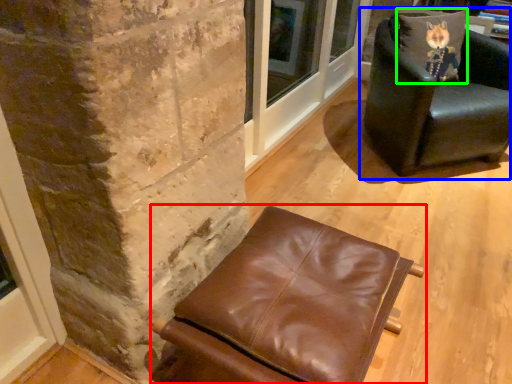
Question: Considering the real-world distances, which object is farthest from chair (highlighted by a red box)? chair (highlighted by a blue box) or pillow (highlighted by a green box)?

Choices:
 (A) chair
 (B) pillow

Answer: (B)